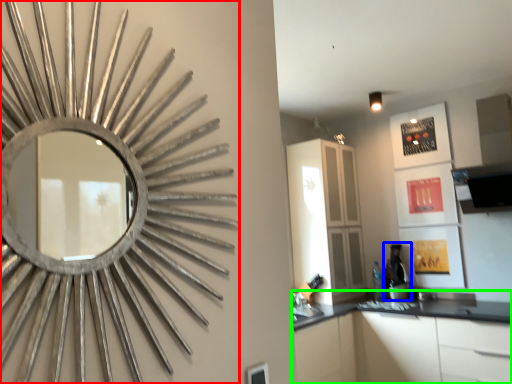
Question: Which object is the farthest from oval (highlighted by a red box)? Choose among these: coffee machine (highlighted by a blue box) or cabinetry (highlighted by a green box).

Choices:
 (A) coffee machine
 (B) cabinetry

Answer: (A)